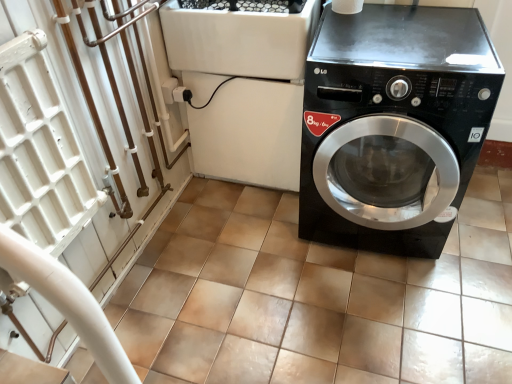
Identify the location of vacant space situated on the left part of black glossy washing machine at right. The image size is (512, 384). point(239,245).